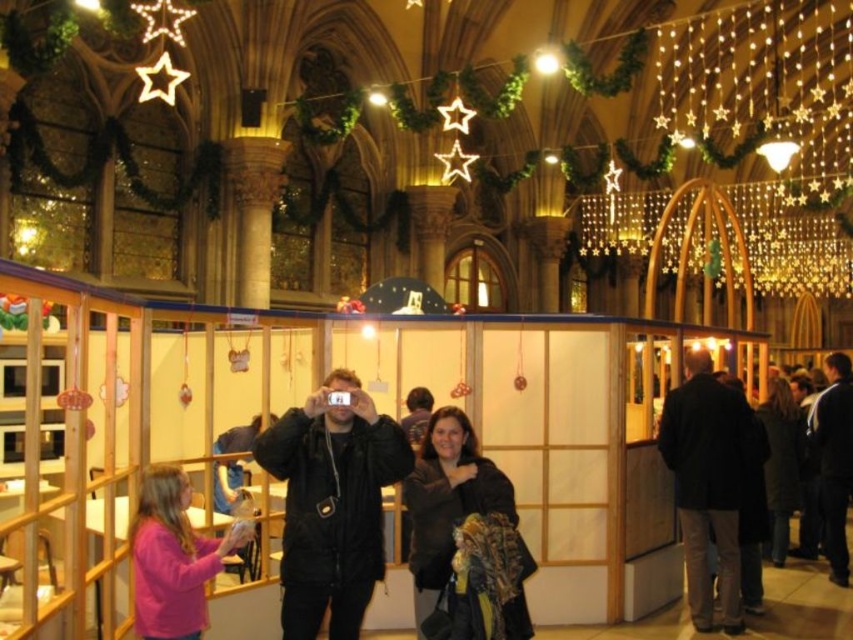
Question: Which point is farther from the camera taking this photo?

Choices:
 (A) (416, 550)
 (B) (784, 394)
 (C) (141, 534)

Answer: (B)

Question: Which object appears closest to the camera in this image?

Choices:
 (A) pink matte jacket at lower left
 (B) dark brown leather jacket at right
 (C) dark brown leather jacket at center

Answer: (A)

Question: Is dark brown leather jacket at center to the right of pink matte jacket at lower left from the viewer's perspective?

Choices:
 (A) yes
 (B) no

Answer: (A)

Question: Can you confirm if dark brown leather jacket at center is bigger than pink matte jacket at lower left?

Choices:
 (A) no
 (B) yes

Answer: (A)

Question: Which point is farther to the camera?

Choices:
 (A) dark brown leather jacket at right
 (B) dark brown leather jacket at center
 (C) pink matte jacket at lower left

Answer: (A)

Question: Considering the relative positions of dark brown leather jacket at center and dark brown leather jacket at right in the image provided, where is dark brown leather jacket at center located with respect to dark brown leather jacket at right?

Choices:
 (A) above
 (B) below

Answer: (B)